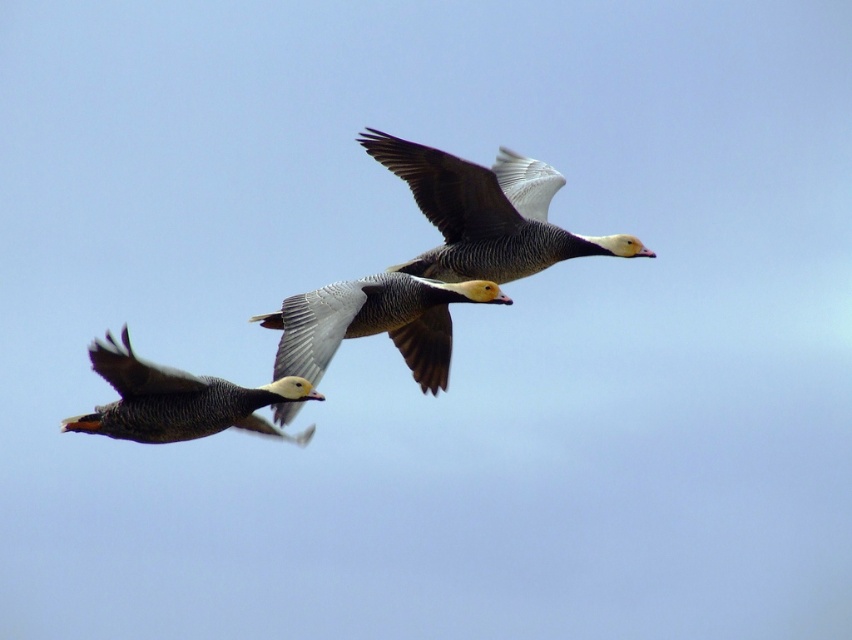
You are a birdwatcher observing the scene. You notice the speckled feathered duck at center and the speckled feathered goose at left. Which bird is closer to you?

The speckled feathered duck at center is closer to you because it is in front of the speckled feathered goose at left.

You are an ornithologist studying bird migration patterns. You observe a speckled feathered goose at upper center in the sky. What are the exact coordinates of this goose?

The speckled feathered goose at upper center is located at coordinates point (486,212).